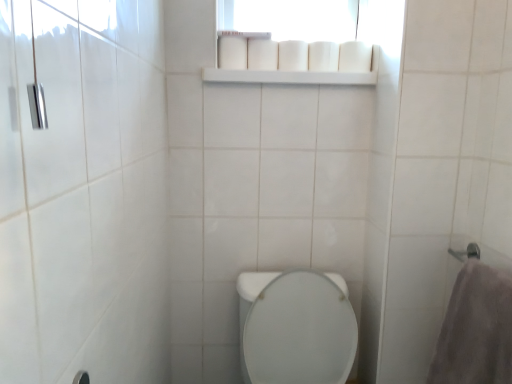
Question: From a real-world perspective, is white matte toilet paper at upper center, acting as the 2th toilet paper starting from the right, positioned over white matte toilet paper at upper center, the second toilet paper in the left-to-right sequence, based on gravity?

Choices:
 (A) yes
 (B) no

Answer: (B)

Question: Considering the relative positions of white matte toilet paper at upper center, which is counted as the fourth toilet paper, starting from the left, and white matte toilet paper at upper center, marked as the fourth toilet paper in a right-to-left arrangement, in the image provided, is white matte toilet paper at upper center, which is counted as the fourth toilet paper, starting from the left, in front of white matte toilet paper at upper center, marked as the fourth toilet paper in a right-to-left arrangement,?

Choices:
 (A) yes
 (B) no

Answer: (B)

Question: Is white matte toilet paper at upper center, which is counted as the fourth toilet paper, starting from the left, thinner than white matte toilet paper at upper center, the second toilet paper in the left-to-right sequence?

Choices:
 (A) no
 (B) yes

Answer: (B)

Question: From the image's perspective, is white matte toilet paper at upper center, acting as the 2th toilet paper starting from the right, over white matte toilet paper at upper center, the second toilet paper in the left-to-right sequence?

Choices:
 (A) no
 (B) yes

Answer: (A)

Question: Is white matte toilet paper at upper center, acting as the 2th toilet paper starting from the right, bigger than white matte toilet paper at upper center, the second toilet paper in the left-to-right sequence?

Choices:
 (A) no
 (B) yes

Answer: (A)

Question: Based on their sizes in the image, would you say white matte toilet paper at upper center, the first toilet paper from the left, is bigger or smaller than white matte shelf at upper center?

Choices:
 (A) small
 (B) big

Answer: (A)

Question: In terms of height, does white matte toilet paper at upper center, the 5th toilet paper when ordered from right to left, look taller or shorter compared to white matte shelf at upper center?

Choices:
 (A) tall
 (B) short

Answer: (A)

Question: Does point (222, 39) appear closer or farther from the camera than point (305, 77)?

Choices:
 (A) farther
 (B) closer

Answer: (A)

Question: Considering the relative positions of white matte toilet paper at upper center, the 5th toilet paper when ordered from right to left, and white matte shelf at upper center in the image provided, is white matte toilet paper at upper center, the 5th toilet paper when ordered from right to left, to the left or to the right of white matte shelf at upper center?

Choices:
 (A) left
 (B) right

Answer: (A)

Question: Choose the correct answer: Is gray plush towel at right inside white matte toilet paper at upper center, which is the 3th toilet paper in right-to-left order, or outside it?

Choices:
 (A) outside
 (B) inside

Answer: (A)

Question: Based on their sizes in the image, would you say gray plush towel at right is bigger or smaller than white matte toilet paper at upper center, which is the 3th toilet paper in right-to-left order?

Choices:
 (A) small
 (B) big

Answer: (B)

Question: Considering the positions of gray plush towel at right and white matte toilet paper at upper center, which is the 3th toilet paper in right-to-left order, in the image, is gray plush towel at right wider or thinner than white matte toilet paper at upper center, which is the 3th toilet paper in right-to-left order,?

Choices:
 (A) wide
 (B) thin

Answer: (A)

Question: Is gray plush towel at right in front of or behind white matte toilet paper at upper center, which is the 3th toilet paper in right-to-left order, in the image?

Choices:
 (A) front
 (B) behind

Answer: (A)

Question: Looking at the image, does gray plush towel at right seem bigger or smaller compared to white matte toilet paper at upper center, acting as the 2th toilet paper starting from the right?

Choices:
 (A) small
 (B) big

Answer: (B)

Question: In the image, is gray plush towel at right on the left side or the right side of white matte toilet paper at upper center, which is counted as the fourth toilet paper, starting from the left?

Choices:
 (A) left
 (B) right

Answer: (B)